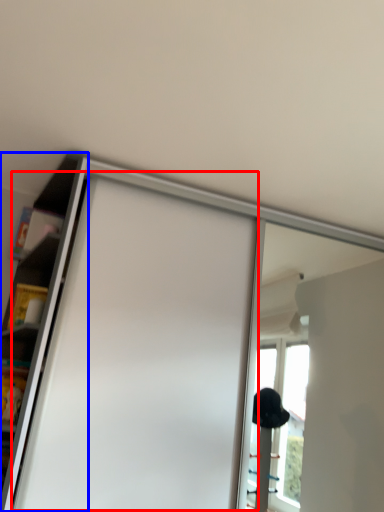
Question: Which object appears closest to the camera in this image, screen door (highlighted by a red box) or shelf (highlighted by a blue box)?

Choices:
 (A) screen door
 (B) shelf

Answer: (B)